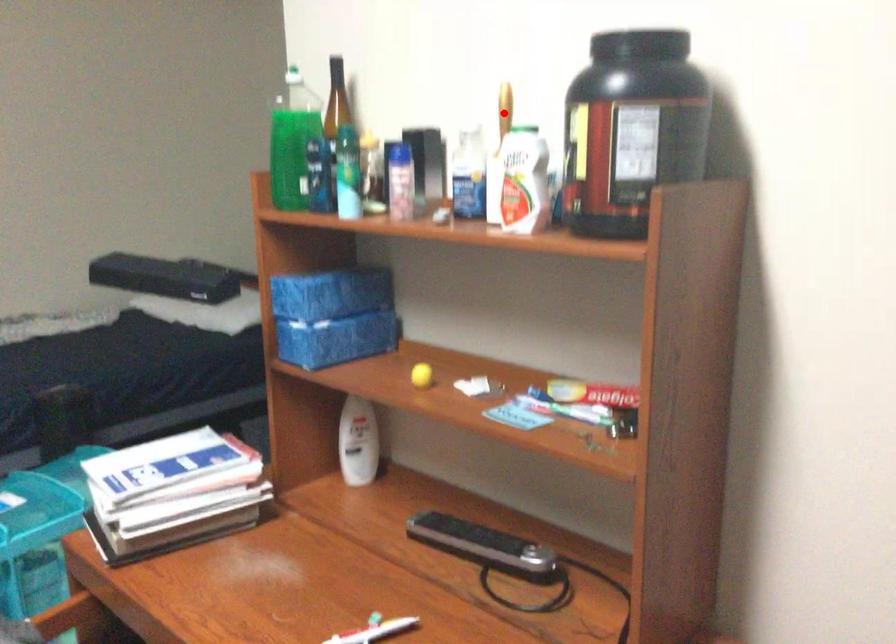
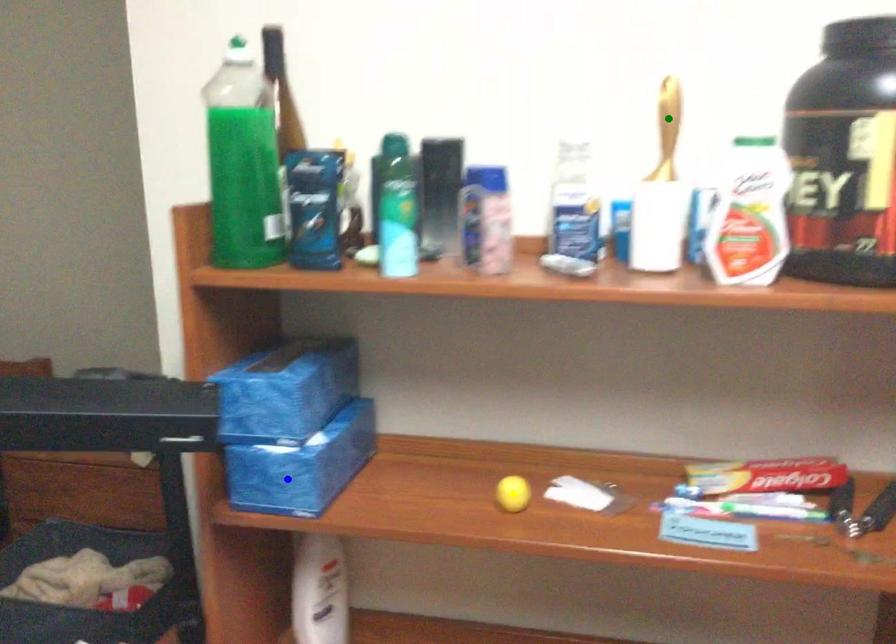
Question: I am providing you with two images of the same scene from different viewpoints. A red point is marked on the first image. You are given multiple points on the second image. Can you choose the point in image 2 that corresponds to the point in image 1?

Choices:
 (A) green point
 (B) yellow point
 (C) blue point

Answer: (A)